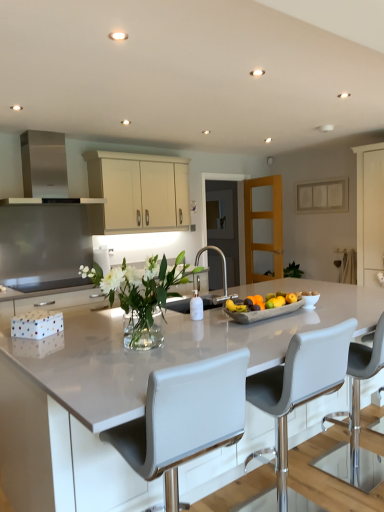
Question: From the image's perspective, is concrete tray of fruits at center located above or below clear glass door at center, the 1th glass door when ordered from left to right?

Choices:
 (A) below
 (B) above

Answer: (A)

Question: From a real-world perspective, relative to clear glass door at center, which is counted as the second glass door, starting from the right, is concrete tray of fruits at center vertically above or below?

Choices:
 (A) below
 (B) above

Answer: (A)

Question: Estimate the real-world distances between objects in this image. Which object is closer to the light brown wooden door at center, the 2th glass door positioned from the left?

Choices:
 (A) cream matte cabinet at upper center
 (B) white leather chair at center, which ranks as the first chair in right-to-left order
 (C) clear glass door at center, which is counted as the second glass door, starting from the right
 (D) white leather chair at center, placed as the first chair when sorted from left to right
 (E) white glossy countertop at center

Answer: (C)

Question: Which object is positioned closest to the concrete tray of fruits at center?

Choices:
 (A) white leather chair at center, which ranks as the first chair in right-to-left order
 (B) clear glass vase at center
 (C) white leather chair at center, arranged as the 2th chair when viewed from the right
 (D) light brown wooden door at center, the 2th glass door positioned from the left
 (E) cream matte cabinet at upper center

Answer: (A)